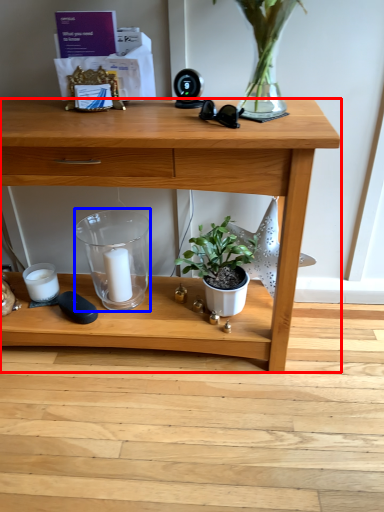
Question: Which object appears farthest to the camera in this image, desk (highlighted by a red box) or glass vase (highlighted by a blue box)?

Choices:
 (A) desk
 (B) glass vase

Answer: (B)